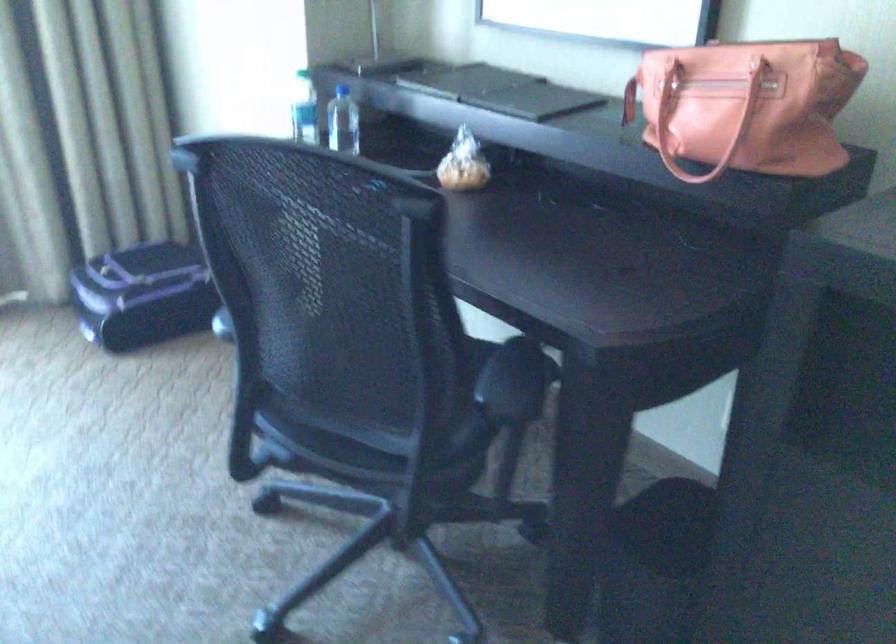
Where would you sit the chair sitting surface? Please return your answer as a coordinate pair (x, y).

(364, 440)